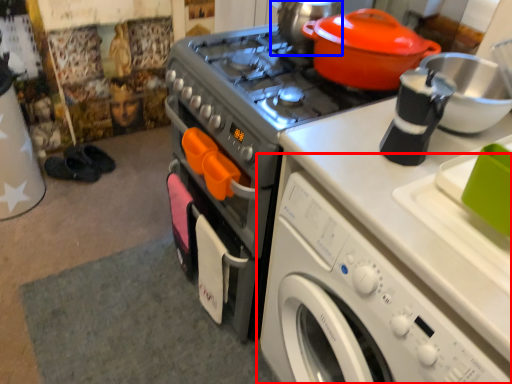
Question: Which of the following is the farthest to the observer, washing machine (highlighted by a red box) or tea pot (highlighted by a blue box)?

Choices:
 (A) washing machine
 (B) tea pot

Answer: (B)